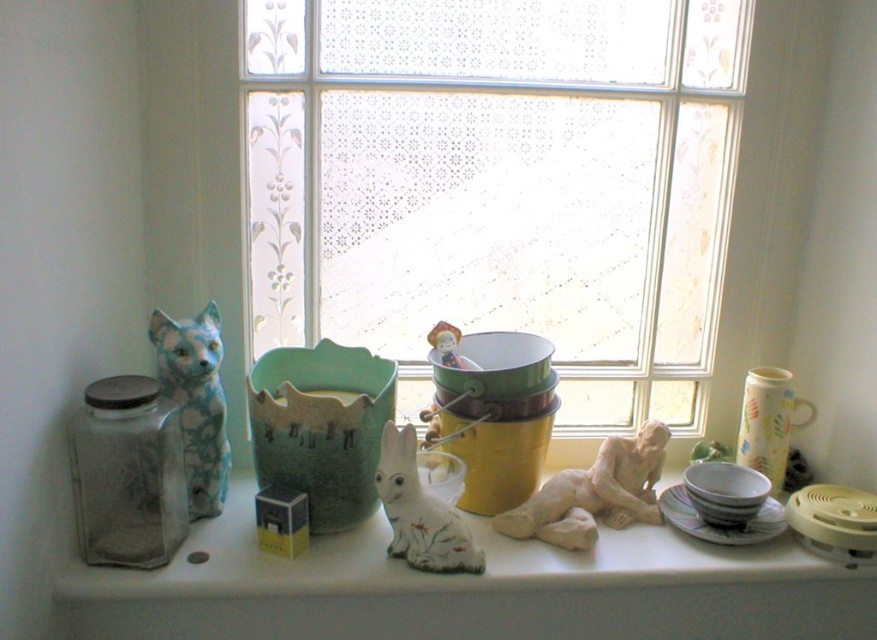
Question: Which point is farther to the camera?

Choices:
 (A) matte white bowl at center
 (B) porcelain plate at center
 (C) yellow matte bucket at center
 (D) white matte rabbit at center

Answer: (C)

Question: Which of the following is the farthest from the observer?

Choices:
 (A) (269, 348)
 (B) (539, 394)
 (C) (186, 516)

Answer: (A)

Question: Can you confirm if transparent glass jar at left is positioned above matte white bowl at center?

Choices:
 (A) no
 (B) yes

Answer: (B)

Question: Is the position of yellow matte bucket at center more distant than that of matte white bowl at center?

Choices:
 (A) yes
 (B) no

Answer: (A)

Question: Among these objects, which one is farthest from the camera?

Choices:
 (A) matte white bowl at center
 (B) white matte rabbit at center
 (C) transparent glass jar at left

Answer: (A)

Question: Is yellow matte bucket at center bigger than matte ceramic vase at right?

Choices:
 (A) yes
 (B) no

Answer: (A)